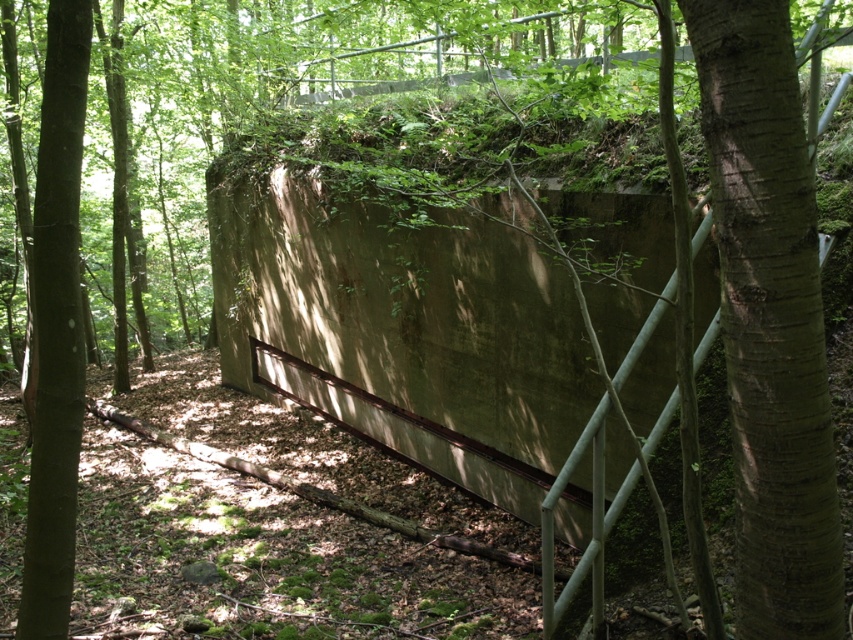
Can you confirm if green rough bark tree at center right is positioned above brown rough bark tree at left?

Correct, green rough bark tree at center right is located above brown rough bark tree at left.

The width and height of the screenshot is (853, 640). What do you see at coordinates (769, 321) in the screenshot?
I see `green rough bark tree at center right` at bounding box center [769, 321].

Which is in front, point (801, 524) or point (47, 333)?

Point (801, 524)

You are a GUI agent. You are given a task and a screenshot of the screen. Output one action in this format:
    pyautogui.click(x=<x>, y=<y>)
    Task: Click on the green rough bark tree at center right
    
    Given the screenshot: What is the action you would take?
    pyautogui.click(x=769, y=321)